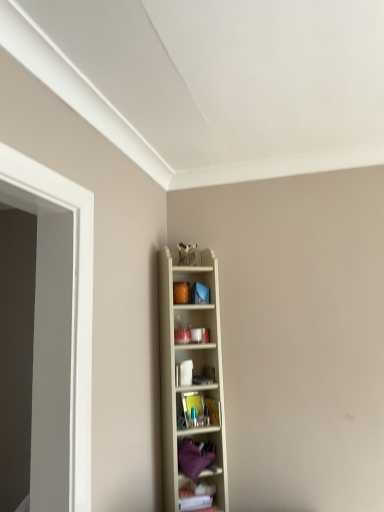
In order to face white plastic shelf at lower right, the 3th shelf positioned from the top, should I rotate leftwards or rightwards?

You should rotate right by 0.387 degrees.

The width and height of the screenshot is (384, 512). I want to click on wooden shelf at center, which appears as the 3th shelf when ordered from the bottom, so click(x=194, y=374).

Considering the points (187, 499) and (163, 448), which point is behind, point (187, 499) or point (163, 448)?

Positioned behind is point (163, 448).

Considering the sizes of white plastic shelf at lower right, the 3th shelf positioned from the top, and wooden shelf at center, positioned as the first shelf in top-to-bottom order, in the image, is white plastic shelf at lower right, the 3th shelf positioned from the top, wider or thinner than wooden shelf at center, positioned as the first shelf in top-to-bottom order,?

Considering their sizes, white plastic shelf at lower right, the 3th shelf positioned from the top, looks slimmer than wooden shelf at center, positioned as the first shelf in top-to-bottom order.

From a real-world perspective, is white plastic shelf at lower right, which is the 1th shelf in bottom-to-top order, located higher than wooden shelf at center, which appears as the 3th shelf when ordered from the bottom?

Actually, white plastic shelf at lower right, which is the 1th shelf in bottom-to-top order, is physically below wooden shelf at center, which appears as the 3th shelf when ordered from the bottom, in the real world.

Is the depth of white plastic shelf at lower right, the 3th shelf positioned from the top, greater than that of wooden shelf at center, which appears as the 3th shelf when ordered from the bottom?

Yes, white plastic shelf at lower right, the 3th shelf positioned from the top, is further from the viewer.

How different are the orientations of white plastic shelf at lower right, which is the 1th shelf in bottom-to-top order, and purple fabric at center, marked as the second shelf in a bottom-to-top arrangement, in degrees?

white plastic shelf at lower right, which is the 1th shelf in bottom-to-top order, and purple fabric at center, marked as the second shelf in a bottom-to-top arrangement, are facing 0.966 degrees away from each other.

From a real-world perspective, does white plastic shelf at lower right, which is the 1th shelf in bottom-to-top order, sit lower than purple fabric at center, marked as the second shelf in a bottom-to-top arrangement?

Yes, from a real-world perspective, white plastic shelf at lower right, which is the 1th shelf in bottom-to-top order, is beneath purple fabric at center, marked as the second shelf in a bottom-to-top arrangement.

Is white plastic shelf at lower right, the 3th shelf positioned from the top, thinner than purple fabric at center, which appears as the 2th shelf when viewed from the top?

Indeed, white plastic shelf at lower right, the 3th shelf positioned from the top, has a lesser width compared to purple fabric at center, which appears as the 2th shelf when viewed from the top.

From the picture: Can you confirm if white plastic shelf at lower right, which is the 1th shelf in bottom-to-top order, is positioned to the right of purple fabric at center, marked as the second shelf in a bottom-to-top arrangement?

Yes.

How different are the orientations of wooden shelf at center, which appears as the 3th shelf when ordered from the bottom, and purple fabric at center, marked as the second shelf in a bottom-to-top arrangement, in degrees?

They differ by 0.000115 degrees in their facing directions.

The image size is (384, 512). In order to click on shelf that appears above the purple fabric at center, which appears as the 2th shelf when viewed from the top (from the image's perspective) in this screenshot , I will do `click(194, 374)`.

Is wooden shelf at center, positioned as the first shelf in top-to-bottom order, to the left or to the right of purple fabric at center, marked as the second shelf in a bottom-to-top arrangement, in the image?

Clearly, wooden shelf at center, positioned as the first shelf in top-to-bottom order, is on the left of purple fabric at center, marked as the second shelf in a bottom-to-top arrangement, in the image.

Is wooden shelf at center, positioned as the first shelf in top-to-bottom order, wider than purple fabric at center, which appears as the 2th shelf when viewed from the top?

No.

From the picture: From the image's perspective, between purple fabric at center, marked as the second shelf in a bottom-to-top arrangement, and white plastic shelf at lower right, which is the 1th shelf in bottom-to-top order, who is located below?

white plastic shelf at lower right, which is the 1th shelf in bottom-to-top order, appears lower in the image.

Based on their positions, is purple fabric at center, marked as the second shelf in a bottom-to-top arrangement, located to the left or right of white plastic shelf at lower right, the 3th shelf positioned from the top?

Clearly, purple fabric at center, marked as the second shelf in a bottom-to-top arrangement, is on the left of white plastic shelf at lower right, the 3th shelf positioned from the top, in the image.

In the scene shown: Is purple fabric at center, which appears as the 2th shelf when viewed from the top, looking in the opposite direction of white plastic shelf at lower right, which is the 1th shelf in bottom-to-top order?

No, white plastic shelf at lower right, which is the 1th shelf in bottom-to-top order, is not at the back of purple fabric at center, which appears as the 2th shelf when viewed from the top.

Does purple fabric at center, which appears as the 2th shelf when viewed from the top, have a greater width compared to white plastic shelf at lower right, the 3th shelf positioned from the top?

Indeed, purple fabric at center, which appears as the 2th shelf when viewed from the top, has a greater width compared to white plastic shelf at lower right, the 3th shelf positioned from the top.

Measure the distance from wooden shelf at center, positioned as the first shelf in top-to-bottom order, to white plastic shelf at lower right, the 3th shelf positioned from the top.

A distance of 14.22 inches exists between wooden shelf at center, positioned as the first shelf in top-to-bottom order, and white plastic shelf at lower right, the 3th shelf positioned from the top.

Can you confirm if wooden shelf at center, positioned as the first shelf in top-to-bottom order, is bigger than white plastic shelf at lower right, the 3th shelf positioned from the top?

Yes.

Which object is thinner, wooden shelf at center, positioned as the first shelf in top-to-bottom order, or white plastic shelf at lower right, the 3th shelf positioned from the top?

Thinner between the two is white plastic shelf at lower right, the 3th shelf positioned from the top.

Is wooden shelf at center, positioned as the first shelf in top-to-bottom order, inside or outside of white plastic shelf at lower right, the 3th shelf positioned from the top?

The correct answer is: outside.

Measure the distance from purple fabric at center, which appears as the 2th shelf when viewed from the top, to wooden shelf at center, positioned as the first shelf in top-to-bottom order.

They are 9.82 inches apart.

Do you think purple fabric at center, marked as the second shelf in a bottom-to-top arrangement, is within wooden shelf at center, which appears as the 3th shelf when ordered from the bottom, or outside of it?

purple fabric at center, marked as the second shelf in a bottom-to-top arrangement, is located inside wooden shelf at center, which appears as the 3th shelf when ordered from the bottom.

Is purple fabric at center, which appears as the 2th shelf when viewed from the top, further to camera compared to wooden shelf at center, positioned as the first shelf in top-to-bottom order?

Yes, purple fabric at center, which appears as the 2th shelf when viewed from the top, is behind wooden shelf at center, positioned as the first shelf in top-to-bottom order.

Which of these two, purple fabric at center, which appears as the 2th shelf when viewed from the top, or wooden shelf at center, which appears as the 3th shelf when ordered from the bottom, is thinner?

wooden shelf at center, which appears as the 3th shelf when ordered from the bottom.

Locate an element on the screen. This screenshot has width=384, height=512. the 2nd shelf counting from the right of the wooden shelf at center, which appears as the 3th shelf when ordered from the bottom is located at coordinates (196, 495).

Locate an element on the screen. The height and width of the screenshot is (512, 384). the 1st shelf in front of the white plastic shelf at lower right, the 3th shelf positioned from the top, counting from the anchor's position is located at coordinates (195, 457).

Estimate the real-world distances between objects in this image. Which object is further from white plastic shelf at lower right, the 3th shelf positioned from the top, purple fabric at center, marked as the second shelf in a bottom-to-top arrangement, or wooden shelf at center, positioned as the first shelf in top-to-bottom order?

wooden shelf at center, positioned as the first shelf in top-to-bottom order, lies further to white plastic shelf at lower right, the 3th shelf positioned from the top, than the other object.

Which object lies nearer to the anchor point wooden shelf at center, which appears as the 3th shelf when ordered from the bottom, purple fabric at center, which appears as the 2th shelf when viewed from the top, or white plastic shelf at lower right, which is the 1th shelf in bottom-to-top order?

Based on the image, purple fabric at center, which appears as the 2th shelf when viewed from the top, appears to be nearer to wooden shelf at center, which appears as the 3th shelf when ordered from the bottom.

Based on their spatial positions, is wooden shelf at center, which appears as the 3th shelf when ordered from the bottom, or white plastic shelf at lower right, which is the 1th shelf in bottom-to-top order, closer to purple fabric at center, which appears as the 2th shelf when viewed from the top?

Based on the image, white plastic shelf at lower right, which is the 1th shelf in bottom-to-top order, appears to be nearer to purple fabric at center, which appears as the 2th shelf when viewed from the top.

From the image, which object appears to be nearer to white plastic shelf at lower right, the 3th shelf positioned from the top, wooden shelf at center, positioned as the first shelf in top-to-bottom order, or purple fabric at center, which appears as the 2th shelf when viewed from the top?

purple fabric at center, which appears as the 2th shelf when viewed from the top, is positioned closer to the anchor white plastic shelf at lower right, the 3th shelf positioned from the top.

Considering their positions, is white plastic shelf at lower right, the 3th shelf positioned from the top, positioned closer to purple fabric at center, which appears as the 2th shelf when viewed from the top, than wooden shelf at center, positioned as the first shelf in top-to-bottom order?

Among the two, white plastic shelf at lower right, the 3th shelf positioned from the top, is located nearer to purple fabric at center, which appears as the 2th shelf when viewed from the top.

Consider the image. From the image, which object appears to be nearer to wooden shelf at center, which appears as the 3th shelf when ordered from the bottom, white plastic shelf at lower right, which is the 1th shelf in bottom-to-top order, or purple fabric at center, which appears as the 2th shelf when viewed from the top?

purple fabric at center, which appears as the 2th shelf when viewed from the top, lies closer to wooden shelf at center, which appears as the 3th shelf when ordered from the bottom, than the other object.

Where is `shelf between wooden shelf at center, positioned as the first shelf in top-to-bottom order, and white plastic shelf at lower right, which is the 1th shelf in bottom-to-top order, vertically`? Image resolution: width=384 pixels, height=512 pixels. shelf between wooden shelf at center, positioned as the first shelf in top-to-bottom order, and white plastic shelf at lower right, which is the 1th shelf in bottom-to-top order, vertically is located at coordinates (195, 457).